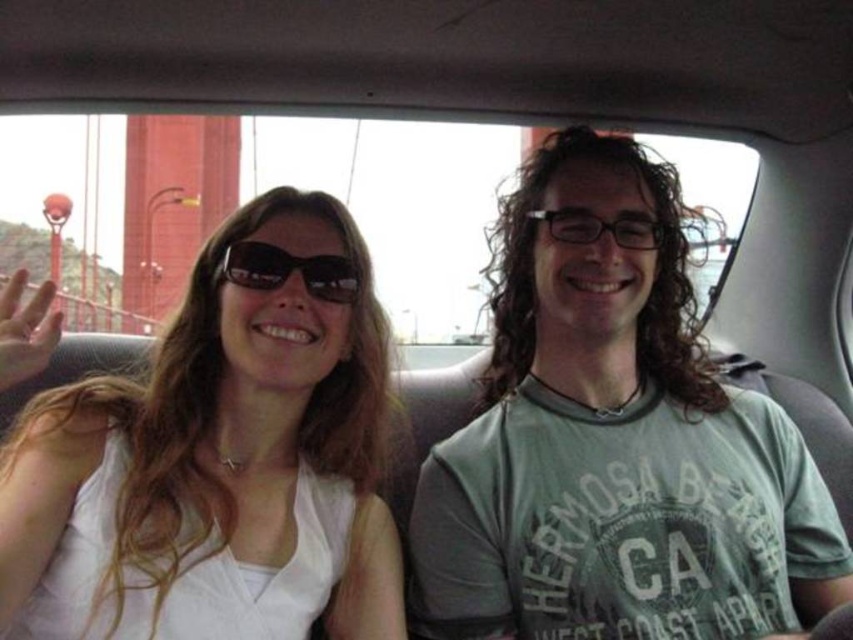
You are a customer at an eyewear store comparing two items displayed on a shelf. The black plastic sunglasses at upper center and the transparent plastic glasses at center are both in front of you. Based on their sizes, which one might be more suitable for someone who prefers a wider frame?

The transparent plastic glasses at center have a greater width than the black plastic sunglasses at upper center, making them more suitable for someone who prefers a wider frame.